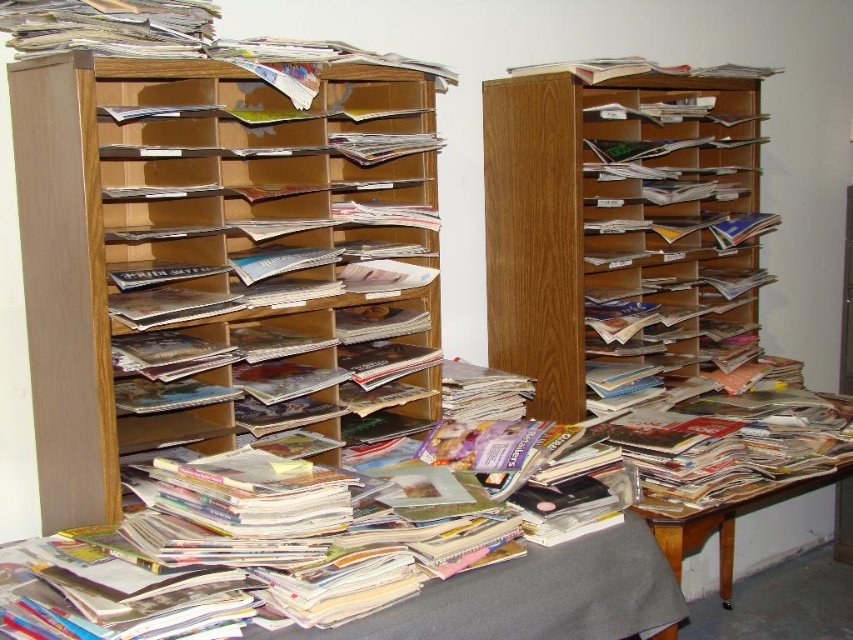
You are organizing a library and need to place a new magazine rack. You have the wooden magazine rack at left and the wooden table at lower right. Based on their positions, which object is higher up?

The wooden magazine rack at left is located above the wooden table at lower right, so it is higher up.

You are standing in the center of the room and want to place a new magazine stack on the wooden bookshelf at center. Where exactly should you place it based on the coordinates provided?

The wooden bookshelf at center should be placed at the coordinates point (621, 228) as specified.

You are organizing a library and need to place a large box that is 1.2 meters wide. You see the wooden magazine rack at left and the wooden table at lower right. Which object can accommodate the box based on their widths?

The wooden magazine rack at left might be wider than wooden table at lower right, so it is possible that the wooden magazine rack at left can accommodate the box if its width is at least 1.2 meters. However, the exact width isn